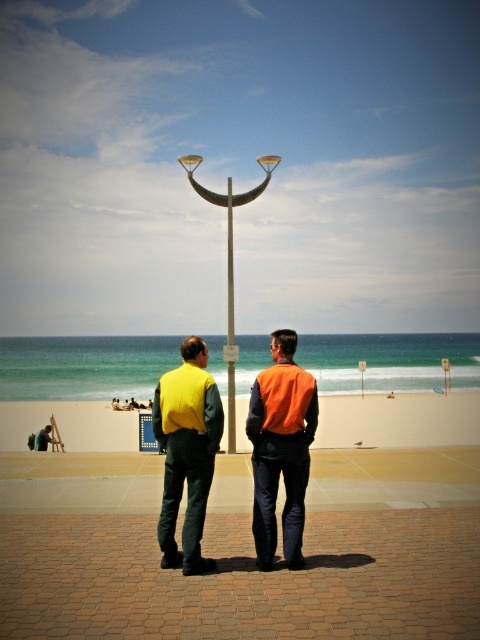
Is matte orange vest at center thinner than orange fabric vest at center?

In fact, matte orange vest at center might be wider than orange fabric vest at center.

Is point (292, 368) less distant than point (309, 460)?

No, (292, 368) is further to viewer.

In order to click on matte orange vest at center in this screenshot , I will do `click(280, 449)`.

Image resolution: width=480 pixels, height=640 pixels. What do you see at coordinates (187, 452) in the screenshot? I see `matte yellow vest at center` at bounding box center [187, 452].

Which of these two, matte yellow vest at center or metallic silver pole at center, stands taller?

metallic silver pole at center

Which is in front, point (169, 472) or point (228, 317)?

Point (169, 472) is more forward.

At what (x,y) coordinates should I click in order to perform the action: click on matte yellow vest at center. Please return your answer as a coordinate pair (x, y). The image size is (480, 640). Looking at the image, I should click on (187, 452).

Does matte orange vest at center come behind matte yellow vest at center?

Yes, matte orange vest at center is behind matte yellow vest at center.

Who is more forward, (269,529) or (211,394)?

Point (211,394)

At what (x,y) coordinates should I click in order to perform the action: click on matte orange vest at center. Please return your answer as a coordinate pair (x, y). Image resolution: width=480 pixels, height=640 pixels. Looking at the image, I should click on (280, 449).